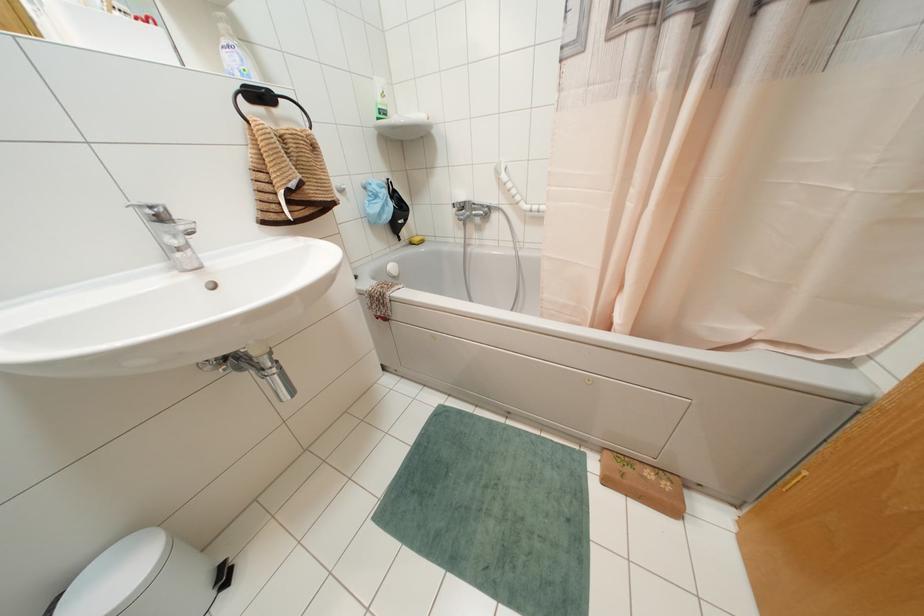
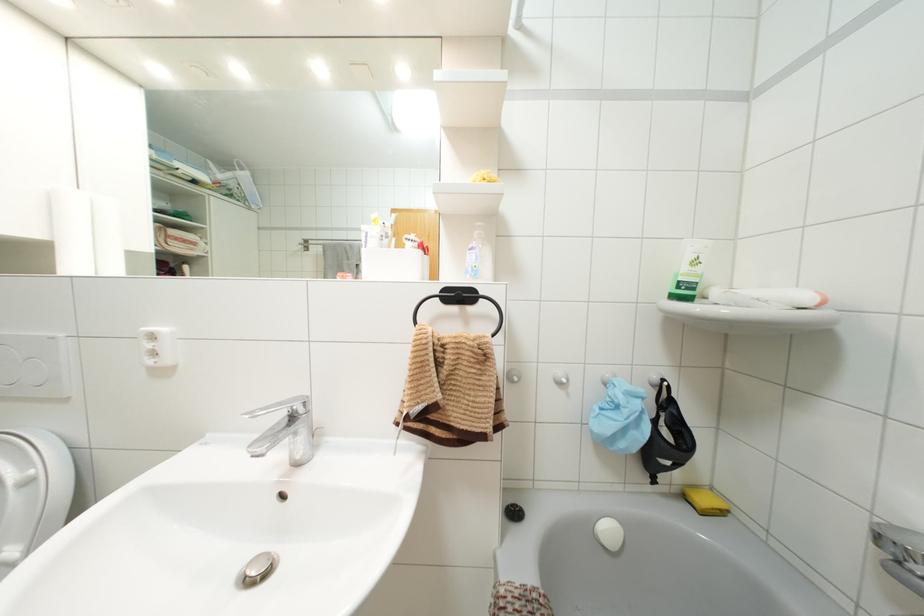
The point at [409,243] is marked in the first image. Where is the corresponding point in the second image?

(685, 496)